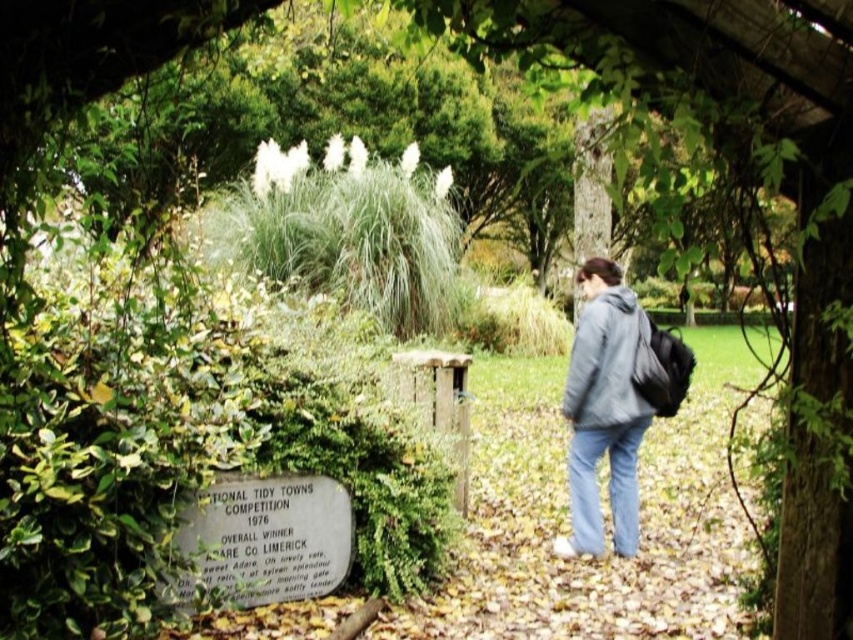
Question: Is gray fleece jacket at right positioned before blue denim jeans at lower center?

Choices:
 (A) no
 (B) yes

Answer: (B)

Question: Estimate the real-world distances between objects in this image. Which object is farther from the gray fleece jacket at right?

Choices:
 (A) blue denim jeans at lower center
 (B) gray fleece jacket at center

Answer: (B)

Question: Where is gray fleece jacket at center located in relation to blue denim jeans at lower center in the image?

Choices:
 (A) below
 (B) above

Answer: (B)

Question: Estimate the real-world distances between objects in this image. Which object is closer to the gray fleece jacket at center?

Choices:
 (A) blue denim jeans at lower center
 (B) gray fleece jacket at right

Answer: (B)

Question: Among these points, which one is farthest from the camera?

Choices:
 (A) pyautogui.click(x=589, y=536)
 (B) pyautogui.click(x=602, y=388)
 (C) pyautogui.click(x=614, y=435)

Answer: (A)

Question: Does gray fleece jacket at right appear on the left side of gray fleece jacket at center?

Choices:
 (A) yes
 (B) no

Answer: (A)